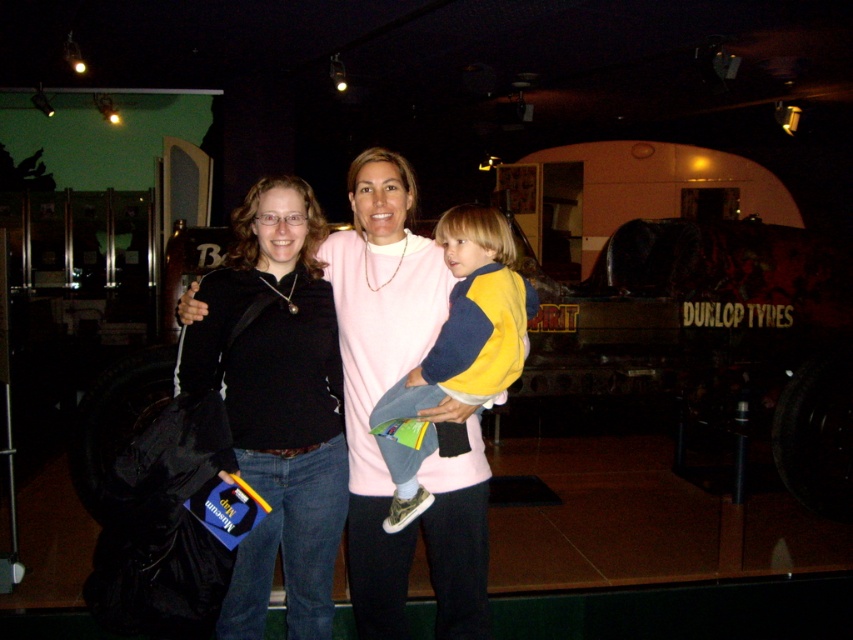
Based on the coordinates provided, which object is located at point (x=380, y=364)?

The pink matte sweater at center is located at point (x=380, y=364).